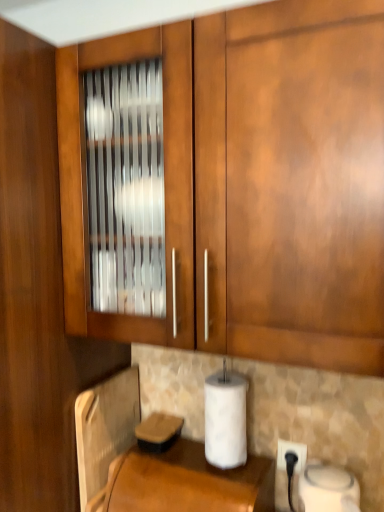
Where is `free space in front of white matte paper towel at lower center`? free space in front of white matte paper towel at lower center is located at coordinates (220, 482).